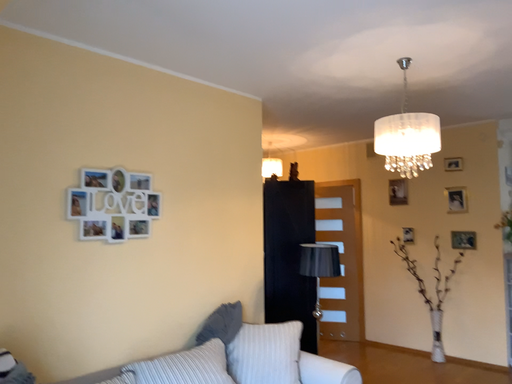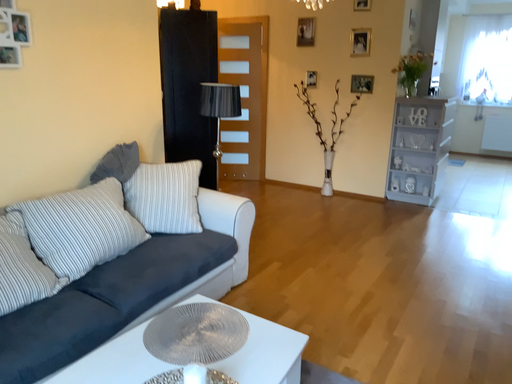
Question: How did the camera likely rotate when shooting the video?

Choices:
 (A) rotated upward
 (B) rotated downward

Answer: (B)